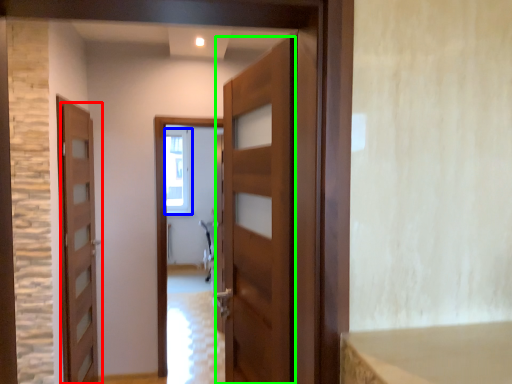
Question: Which is nearer to the door (highlighted by a red box)? window (highlighted by a blue box) or door (highlighted by a green box).

Choices:
 (A) window
 (B) door

Answer: (B)